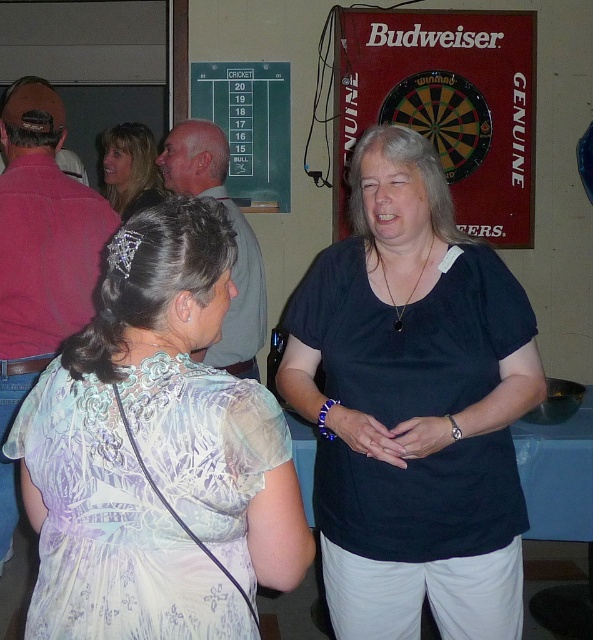
Question: Which of these objects is positioned farthest from the black matte shirt at center?

Choices:
 (A) gray hair at center
 (B) blonde hair at upper left

Answer: (B)

Question: Can you confirm if pink cotton shirt at left is thinner than blonde hair at upper left?

Choices:
 (A) yes
 (B) no

Answer: (B)

Question: Can you confirm if green chalkboard at upper center is thinner than blonde hair at upper left?

Choices:
 (A) yes
 (B) no

Answer: (B)

Question: Which of the following is the farthest from the observer?

Choices:
 (A) black matte shirt at center
 (B) pink cotton shirt at left
 (C) green chalkboard at upper center
 (D) light purple sheer blouse at center

Answer: (C)

Question: Which point is farther to the camera?

Choices:
 (A) (59, 264)
 (B) (192, 140)

Answer: (B)

Question: Can you confirm if pink cotton shirt at left is positioned to the right of green chalkboard at upper center?

Choices:
 (A) no
 (B) yes

Answer: (A)